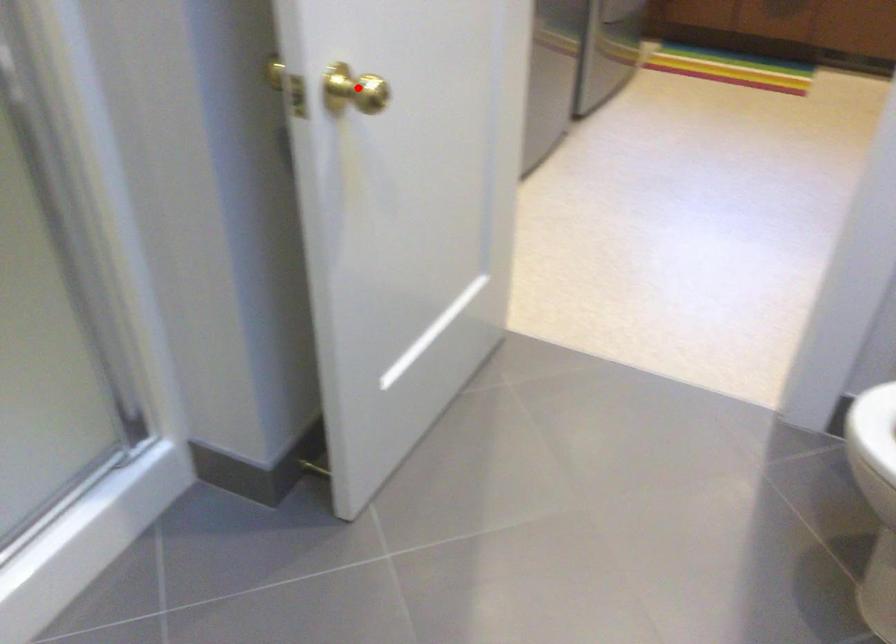
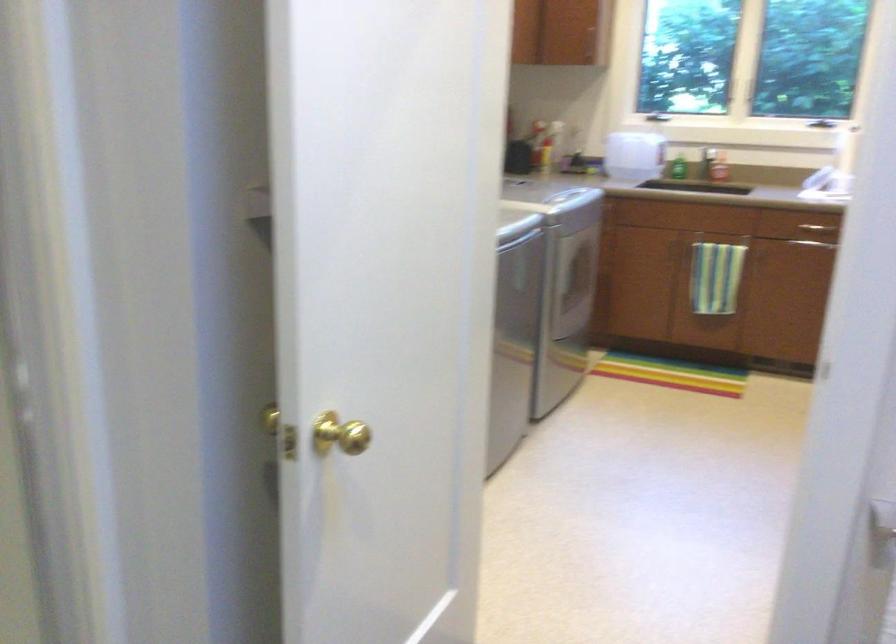
Where in the second image is the point corresponding to the highlighted location from the first image?

(339, 433)